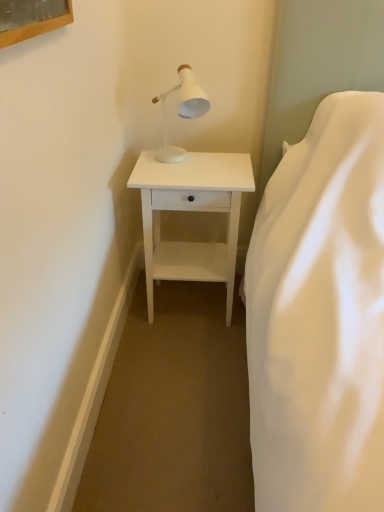
Question: Is white matte table lamp at upper center to the left or to the right of white matte nightstand at lower center in the image?

Choices:
 (A) left
 (B) right

Answer: (A)

Question: Considering the positions of white matte table lamp at upper center and white matte nightstand at lower center in the image, is white matte table lamp at upper center wider or thinner than white matte nightstand at lower center?

Choices:
 (A) thin
 (B) wide

Answer: (A)

Question: From the image's perspective, is white matte table lamp at upper center above or below white matte nightstand at lower center?

Choices:
 (A) below
 (B) above

Answer: (B)

Question: Is white matte nightstand at lower center in front of or behind white matte table lamp at upper center in the image?

Choices:
 (A) front
 (B) behind

Answer: (B)

Question: Considering the positions of point (244, 178) and point (190, 80), is point (244, 178) closer or farther from the camera than point (190, 80)?

Choices:
 (A) farther
 (B) closer

Answer: (A)

Question: Would you say white matte nightstand at lower center is to the left or to the right of white matte table lamp at upper center in the picture?

Choices:
 (A) left
 (B) right

Answer: (B)

Question: In terms of height, does white matte nightstand at lower center look taller or shorter compared to white matte table lamp at upper center?

Choices:
 (A) short
 (B) tall

Answer: (B)